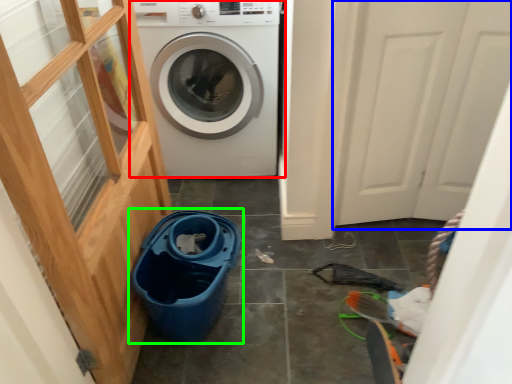
Question: Considering the real-world distances, which object is closest to washing machine (highlighted by a red box)? screen door (highlighted by a blue box) or recycling bin (highlighted by a green box).

Choices:
 (A) screen door
 (B) recycling bin

Answer: (A)